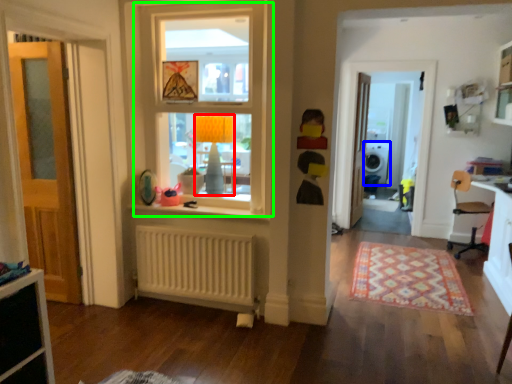
Question: Based on their relative distances, which object is farther from lamp (highlighted by a red box)? Choose from dish washer (highlighted by a blue box) and window (highlighted by a green box).

Choices:
 (A) dish washer
 (B) window

Answer: (A)